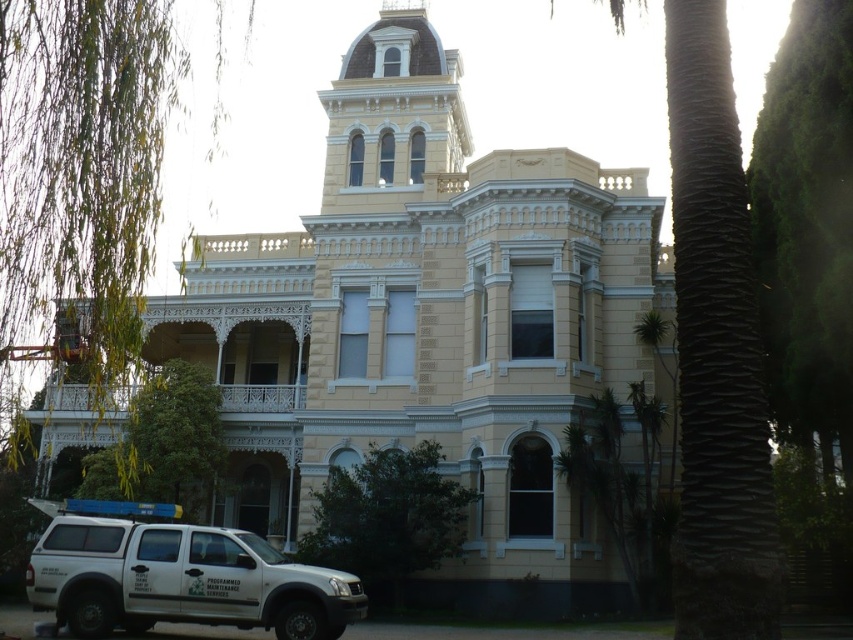
Who is taller, beige stone mansion at center or white matte suv at lower left?

beige stone mansion at center

Which is behind, point (426, 211) or point (170, 548)?

The point (426, 211) is behind.

Identify the location of beige stone mansion at center. (431, 324).